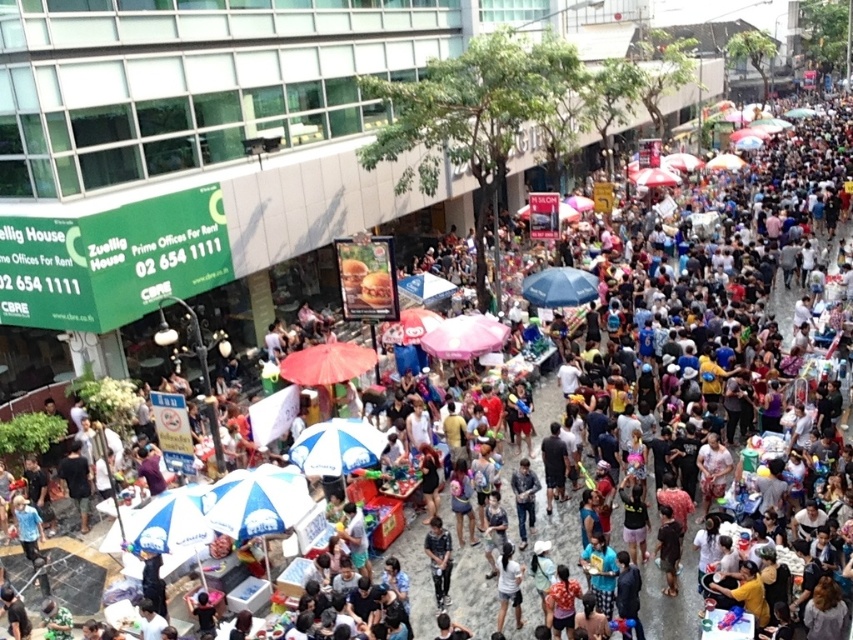
You are navigating through the bustling outdoor market and need to reach a specific location. You notice two points marked in the scene, point (544,276) and point (505,560). Which point is closer to you as you stand at the starting position?

Point (505,560) is closer to you because point (544,276) is behind it.

You are at the market and want to locate the pink fabric umbrella at center. Which side of the denim shirt at center is it on?

The pink fabric umbrella at center is to the left of the denim shirt at center.